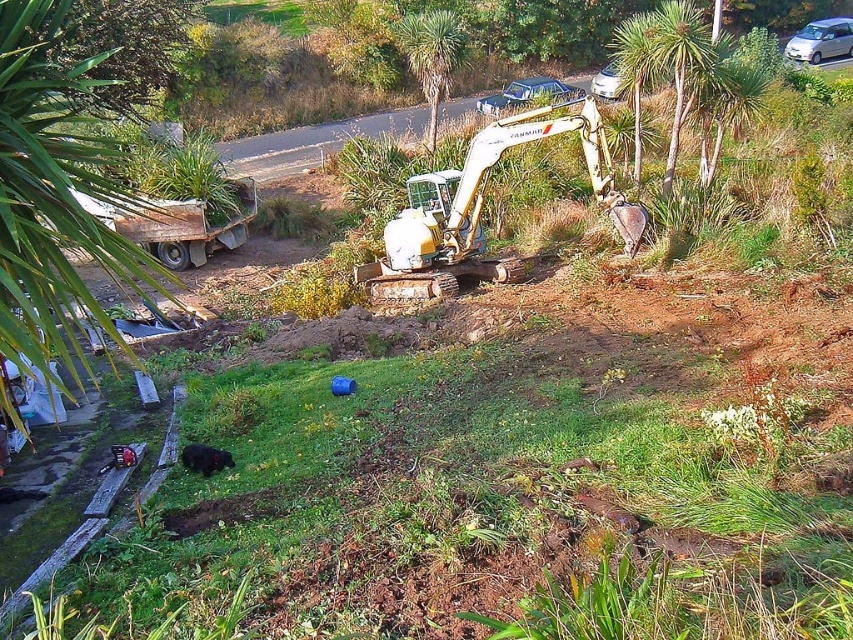
You are a delivery person who needs to park your silver metallic car at upper right without blocking the view of the green leafy palm tree at center from the main road. Based on their heights, is this possible?

The green leafy palm tree at center is much taller than the silver metallic car at upper right, so parking the silver metallic car at upper right would not block the view of the green leafy palm tree at center from the main road since the car is shorter.

You are a delivery person trying to park your 2.5 meters tall delivery van behind the silver metallic car at upper center. The van needs clearance to pass under the green leafy palm tree at center. Can the van pass under the tree without hitting it?

The green leafy palm tree at center has a greater height compared to the silver metallic car at upper center. Since the tree is taller than the car, and the van is 2.5 meters tall, it is likely that the van can pass under the tree without hitting it, provided the tree height exceeds 2.5 meters. However, the exact height of the tree isn

You are standing at the point where the black dog is located. The green leafy palm tree at upper center is at coordinates 0.108, 0.747. If you want to walk directly towards the palm tree, in which direction should you head?

You should head towards the upper center direction since the green leafy palm tree at upper center is located at coordinates (636, 68), which is above and to the left of your current position near the black dog on the grass.